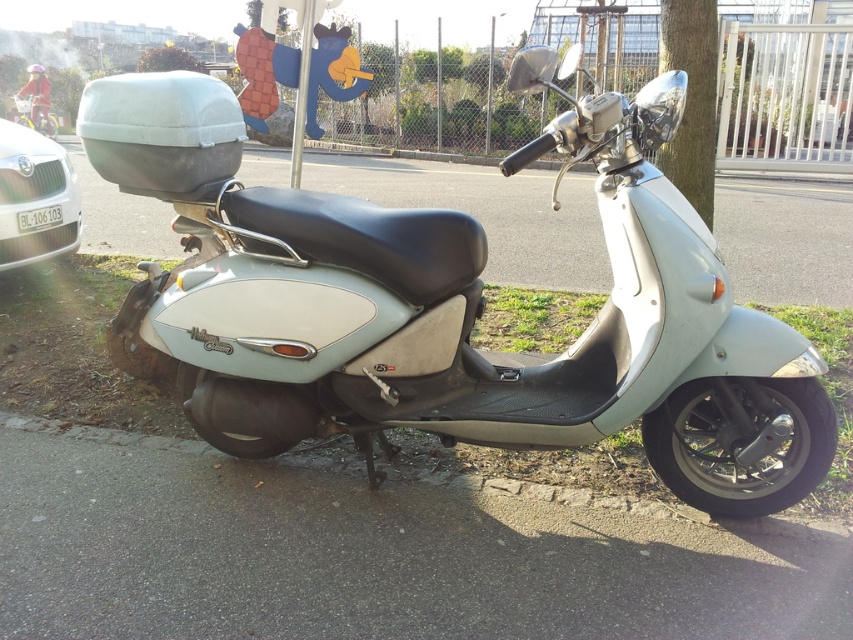
Question: Can you confirm if matte white car at left is positioned above matte white scooter at upper left?

Choices:
 (A) no
 (B) yes

Answer: (A)

Question: Which of the following is the farthest from the observer?

Choices:
 (A) (28, 104)
 (B) (35, 259)

Answer: (A)

Question: Which object appears farthest from the camera in this image?

Choices:
 (A) matte white car at left
 (B) matte white scooter at upper left

Answer: (B)

Question: Is satin silver scooter at center bigger than white plastic license plate at center?

Choices:
 (A) yes
 (B) no

Answer: (A)

Question: Which object is farther from the camera taking this photo?

Choices:
 (A) matte white scooter at upper left
 (B) white plastic license plate at center
 (C) matte white car at left

Answer: (A)

Question: Is matte white car at left positioned in front of matte white scooter at upper left?

Choices:
 (A) no
 (B) yes

Answer: (B)